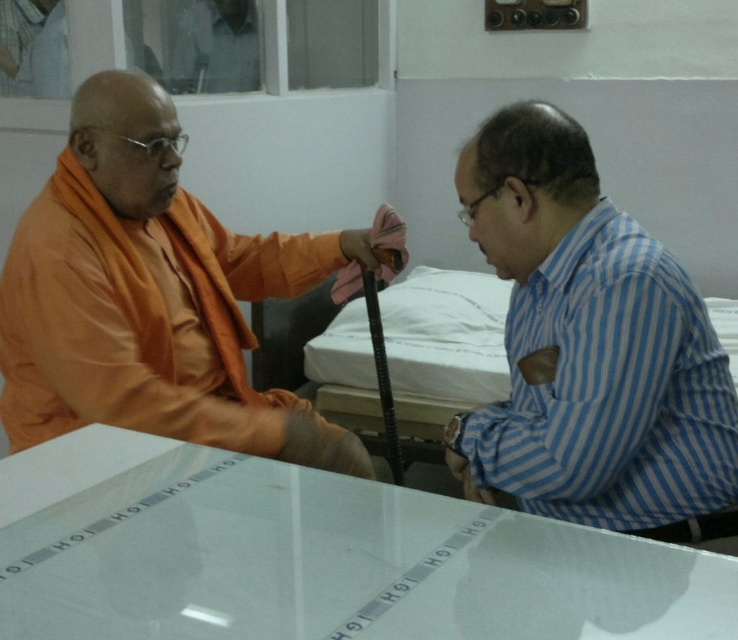
You are a visitor entering the room and want to sit down at the transparent glass table at center without disturbing the orange silk monk at left. Can you sit on the side opposite to where the orange silk monk is sitting?

The transparent glass table at center is positioned under orange silk monk at left, so sitting on the opposite side would be possible as the table is under the monk, implying it extends beyond their seating area.

You are a photographer planning to take a group photo of the orange silk monk at left and the blue striped shirt at right. Considering their heights, which person should you position closer to the camera to ensure both appear equally tall in the photo?

The orange silk monk at left is much taller than the blue striped shirt at right. To make them appear equally tall in the photo, position the blue striped shirt at right closer to the camera since they are shorter.

You are sitting at the table in the image and want to place a small object on the table. You have two points to choose from, point 1 at coordinates point [269,518] and point 2 at coordinates point [55,349]. Which point is closer to you?

Point [269,518] is in front of point [55,349], so placing the object there would be closer to you.